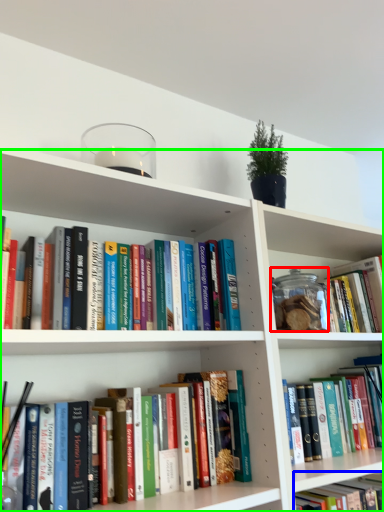
Question: Which object is positioned closest to glass jar (highlighted by a red box)? Select from book (highlighted by a blue box) and bookcase (highlighted by a green box).

Choices:
 (A) book
 (B) bookcase

Answer: (B)